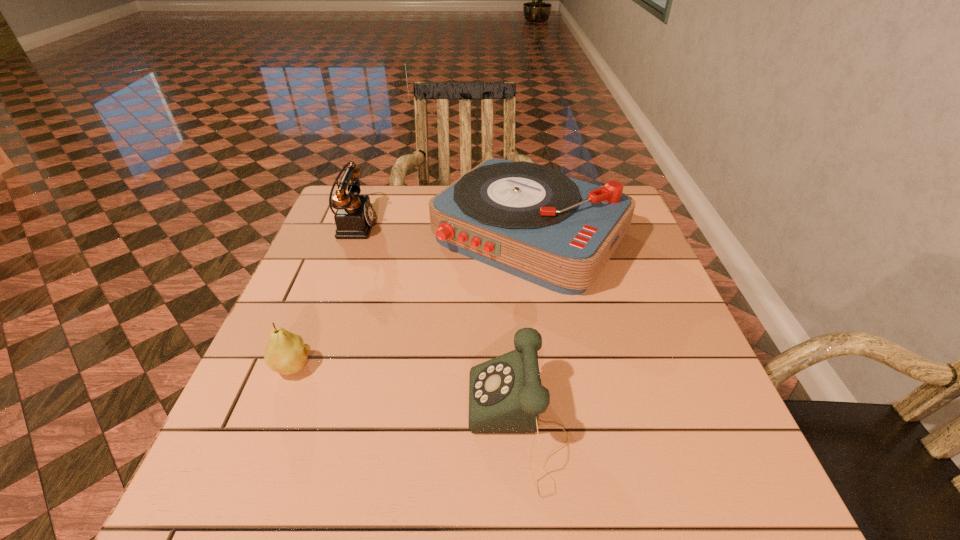
Where is `vacant space located 0.150m on the dial of the shorter telephone`? vacant space located 0.150m on the dial of the shorter telephone is located at coordinates (384, 426).

Find the location of a particular element. vacant area situated 0.380m on the dial of the shorter telephone is located at coordinates (254, 426).

Find the location of a particular element. Image resolution: width=960 pixels, height=540 pixels. telephone situated at the far edge is located at coordinates pos(354,218).

Where is `record player present at the far edge`? record player present at the far edge is located at coordinates (529, 220).

This screenshot has height=540, width=960. I want to click on object positioned at the near edge, so click(x=505, y=393).

Locate an element on the screen. The height and width of the screenshot is (540, 960). telephone positioned at the left edge is located at coordinates (354, 218).

Identify the location of pear positioned at the left edge. This screenshot has height=540, width=960. (286, 353).

I want to click on object located at the right edge, so click(x=529, y=220).

In order to click on object at the far left corner in this screenshot , I will do `click(354, 218)`.

You are a GUI agent. You are given a task and a screenshot of the screen. Output one action in this format:
    pyautogui.click(x=<x>, y=<y>)
    Task: Click on the object at the far right corner
    
    Given the screenshot: What is the action you would take?
    pyautogui.click(x=529, y=220)